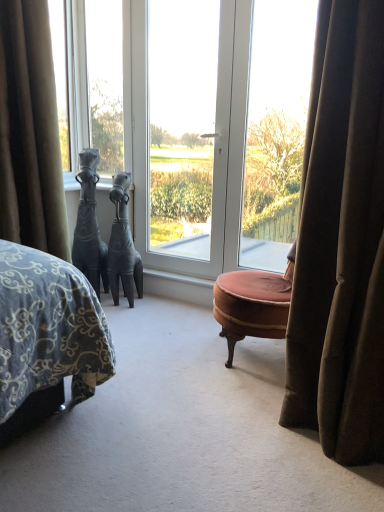
Question: Can you confirm if transparent glass screen door at center is positioned to the left of clear glass window at center, positioned as the 3th window in left-to-right order?

Choices:
 (A) yes
 (B) no

Answer: (A)

Question: Can you confirm if transparent glass screen door at center is taller than clear glass window at center, the first window viewed from the right?

Choices:
 (A) yes
 (B) no

Answer: (A)

Question: Is transparent glass screen door at center positioned with its back to clear glass window at center, positioned as the 3th window in left-to-right order?

Choices:
 (A) no
 (B) yes

Answer: (A)

Question: From the image's perspective, is transparent glass screen door at center over clear glass window at center, positioned as the 3th window in left-to-right order?

Choices:
 (A) no
 (B) yes

Answer: (B)

Question: From a real-world perspective, does transparent glass screen door at center sit lower than clear glass window at center, the first window viewed from the right?

Choices:
 (A) no
 (B) yes

Answer: (A)

Question: Is transparent glass screen door at center in front of clear glass window at center, positioned as the 3th window in left-to-right order?

Choices:
 (A) no
 (B) yes

Answer: (A)

Question: Can you see transparent glass screen door at center touching velvet brown ottoman at center?

Choices:
 (A) no
 (B) yes

Answer: (A)

Question: From the image's perspective, is transparent glass screen door at center located above velvet brown ottoman at center?

Choices:
 (A) no
 (B) yes

Answer: (B)

Question: Is transparent glass screen door at center not close to velvet brown ottoman at center?

Choices:
 (A) no
 (B) yes

Answer: (B)

Question: Could you tell me if transparent glass screen door at center is facing velvet brown ottoman at center?

Choices:
 (A) yes
 (B) no

Answer: (B)

Question: Is transparent glass screen door at center smaller than velvet brown ottoman at center?

Choices:
 (A) yes
 (B) no

Answer: (A)

Question: Is transparent glass screen door at center positioned with its back to velvet brown ottoman at center?

Choices:
 (A) no
 (B) yes

Answer: (A)

Question: From the image's perspective, is black matte horse at left, the 1th sculpture from the left, located above velvet brown ottoman at center?

Choices:
 (A) no
 (B) yes

Answer: (B)